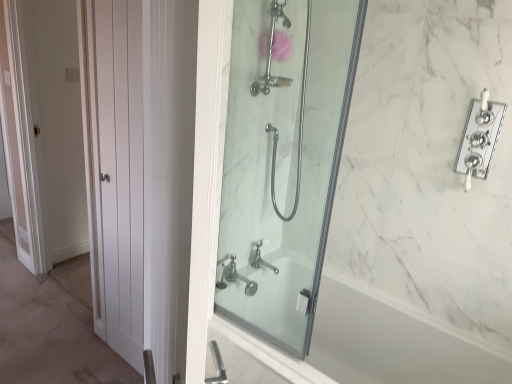
What is the approximate width of polished chrome faucet at upper right?

It is 1.58 inches.

This screenshot has width=512, height=384. What do you see at coordinates (284, 163) in the screenshot? I see `clear glass shower at center` at bounding box center [284, 163].

Where is `clear glass shower at center`? clear glass shower at center is located at coordinates (284, 163).

What is the approximate width of pink fabric flower at upper center?

pink fabric flower at upper center is 4.99 inches in width.

The width and height of the screenshot is (512, 384). I want to click on white marble bathtub at center, so click(x=366, y=345).

Who is shorter, chrome metallic faucet at center or pink fabric flower at upper center?

With less height is chrome metallic faucet at center.

Can you tell me how much chrome metallic faucet at center and pink fabric flower at upper center differ in facing direction?

The angular difference between chrome metallic faucet at center and pink fabric flower at upper center is 0.112 degrees.

Which object is further away from the camera taking this photo, chrome metallic faucet at center or pink fabric flower at upper center?

chrome metallic faucet at center is more distant.

Can you confirm if chrome metallic faucet at center is bigger than pink fabric flower at upper center?

Correct, chrome metallic faucet at center is larger in size than pink fabric flower at upper center.

Can you confirm if white marble bathtub at center is bigger than polished chrome faucet at upper right?

Yes, white marble bathtub at center is bigger than polished chrome faucet at upper right.

Looking at their sizes, would you say white marble bathtub at center is wider or thinner than polished chrome faucet at upper right?

white marble bathtub at center is wider than polished chrome faucet at upper right.

Does white marble bathtub at center have a lesser height compared to polished chrome faucet at upper right?

No.

Is white marble bathtub at center bigger or smaller than chrome metallic faucet at center?

Clearly, white marble bathtub at center is larger in size than chrome metallic faucet at center.

Is point (456, 382) in front of point (224, 265)?

Yes, point (456, 382) is closer to viewer.

Measure the distance between white marble bathtub at center and chrome metallic faucet at center.

They are 22.27 inches apart.

Between point (237, 274) and point (478, 375), which one is positioned behind?

The point (237, 274) is more distant.

Based on the photo, from a real-world perspective, is chrome metallic faucet at center physically below white marble bathtub at center?

Actually, chrome metallic faucet at center is physically above white marble bathtub at center in the real world.

Based on the photo, is chrome metallic faucet at center closer to the viewer compared to white marble bathtub at center?

No, chrome metallic faucet at center is further to the viewer.

Is chrome metallic faucet at center beside white marble bathtub at center?

No, chrome metallic faucet at center is not making contact with white marble bathtub at center.

Considering the positions of objects chrome metallic faucet at center and polished chrome faucet at upper right in the image provided, who is more to the right, chrome metallic faucet at center or polished chrome faucet at upper right?

polished chrome faucet at upper right is more to the right.

How many degrees apart are the facing directions of chrome metallic faucet at center and polished chrome faucet at upper right?

The angle between the facing direction of chrome metallic faucet at center and the facing direction of polished chrome faucet at upper right is 90.9 degrees.

From a real-world perspective, which is physically below, chrome metallic faucet at center or polished chrome faucet at upper right?

chrome metallic faucet at center.

Locate an element on the screen. The width and height of the screenshot is (512, 384). sink behind the polished chrome faucet at upper right is located at coordinates (234, 276).

Between point (480, 117) and point (322, 199), which one is positioned behind?

Positioned behind is point (322, 199).

Which object is wider, polished chrome faucet at upper right or clear glass shower at center?

Wider between the two is clear glass shower at center.

Consider the image. Does polished chrome faucet at upper right turn towards clear glass shower at center?

No, polished chrome faucet at upper right does not turn towards clear glass shower at center.

From the image's perspective, which is below, polished chrome faucet at upper right or white marble bathtub at center?

white marble bathtub at center, from the image's perspective.

Is polished chrome faucet at upper right located outside white marble bathtub at center?

polished chrome faucet at upper right is positioned outside white marble bathtub at center.

Are polished chrome faucet at upper right and white marble bathtub at center located far from each other?

polished chrome faucet at upper right is near white marble bathtub at center, not far away.

Is polished chrome faucet at upper right positioned in front of white marble bathtub at center?

No, polished chrome faucet at upper right is behind white marble bathtub at center.

At what (x,y) coordinates should I click in order to perform the action: click on flower lying in front of the chrome metallic faucet at center. Please return your answer as a coordinate pair (x, y). Looking at the image, I should click on (281, 46).

What are the coordinates of `bathtub to the left of polished chrome faucet at upper right` in the screenshot? It's located at (366, 345).

Considering their positions, is clear glass shower at center positioned closer to white marble bathtub at center than polished chrome faucet at upper right?

Among the two, clear glass shower at center is located nearer to white marble bathtub at center.

Based on their spatial positions, is white marble bathtub at center or pink fabric flower at upper center further from clear glass shower at center?

white marble bathtub at center.

When comparing their distances from pink fabric flower at upper center, does polished chrome faucet at upper right or chrome metallic faucet at center seem closer?

polished chrome faucet at upper right is closer to pink fabric flower at upper center.

From the image, which object appears to be farther from polished chrome faucet at upper right, pink fabric flower at upper center or clear glass shower at center?

Based on the image, clear glass shower at center appears to be further to polished chrome faucet at upper right.

Consider the image. From the image, which object appears to be farther from white marble bathtub at center, pink fabric flower at upper center or chrome metallic faucet at lower center?

pink fabric flower at upper center.

Which object lies nearer to the anchor point clear glass shower at center, pink fabric flower at upper center or chrome metallic faucet at center?

chrome metallic faucet at center.

Considering their positions, is white marble bathtub at center positioned further to polished chrome faucet at upper right than clear glass shower at center?

white marble bathtub at center.

Estimate the real-world distances between objects in this image. Which object is further from polished chrome faucet at upper right, white marble bathtub at center or chrome metallic faucet at center?

Based on the image, chrome metallic faucet at center appears to be further to polished chrome faucet at upper right.

Image resolution: width=512 pixels, height=384 pixels. I want to click on bathtub between clear glass shower at center and chrome metallic faucet at lower center from front to back, so click(x=366, y=345).

Locate an element on the screen. This screenshot has width=512, height=384. flower between clear glass shower at center and polished chrome faucet at upper right in the horizontal direction is located at coordinates (281, 46).

Where is `tap between pink fabric flower at upper center and white marble bathtub at center in the vertical direction`? The height and width of the screenshot is (384, 512). tap between pink fabric flower at upper center and white marble bathtub at center in the vertical direction is located at coordinates (259, 257).

Find the location of a particular element. tap between pink fabric flower at upper center and chrome metallic faucet at center in the vertical direction is located at coordinates (259, 257).